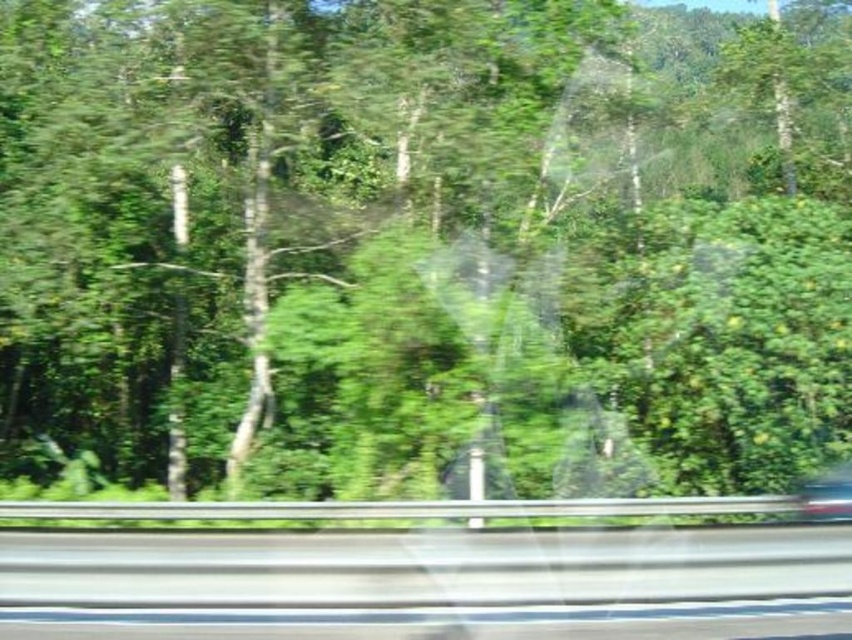
Can you confirm if smooth asphalt highway at center is positioned below metallic silver car at lower right?

Incorrect, smooth asphalt highway at center is not positioned below metallic silver car at lower right.

Does smooth asphalt highway at center appear on the right side of metallic silver car at lower right?

Incorrect, smooth asphalt highway at center is not on the right side of metallic silver car at lower right.

The width and height of the screenshot is (852, 640). I want to click on smooth asphalt highway at center, so click(430, 584).

Image resolution: width=852 pixels, height=640 pixels. In order to click on smooth asphalt highway at center in this screenshot , I will do `click(430, 584)`.